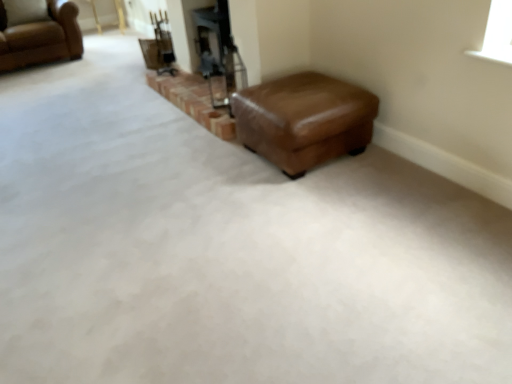
Question: Looking at their shapes, would you say brown leather ottoman at center is wider or thinner than brown leather chair at upper left?

Choices:
 (A) thin
 (B) wide

Answer: (A)

Question: From the image's perspective, relative to brown leather chair at upper left, is brown leather ottoman at center above or below?

Choices:
 (A) below
 (B) above

Answer: (A)

Question: In the image, is brown leather ottoman at center positioned in front of or behind brown leather chair at upper left?

Choices:
 (A) behind
 (B) front

Answer: (B)

Question: Considering the positions of point (71, 23) and point (231, 104), is point (71, 23) closer or farther from the camera than point (231, 104)?

Choices:
 (A) farther
 (B) closer

Answer: (A)

Question: Is brown leather chair at upper left wider or thinner than brown leather ottoman at center?

Choices:
 (A) thin
 (B) wide

Answer: (B)

Question: From the image's perspective, is brown leather chair at upper left located above or below brown leather ottoman at center?

Choices:
 (A) above
 (B) below

Answer: (A)

Question: From a real-world perspective, relative to brown leather ottoman at center, is brown leather chair at upper left vertically above or below?

Choices:
 (A) below
 (B) above

Answer: (B)